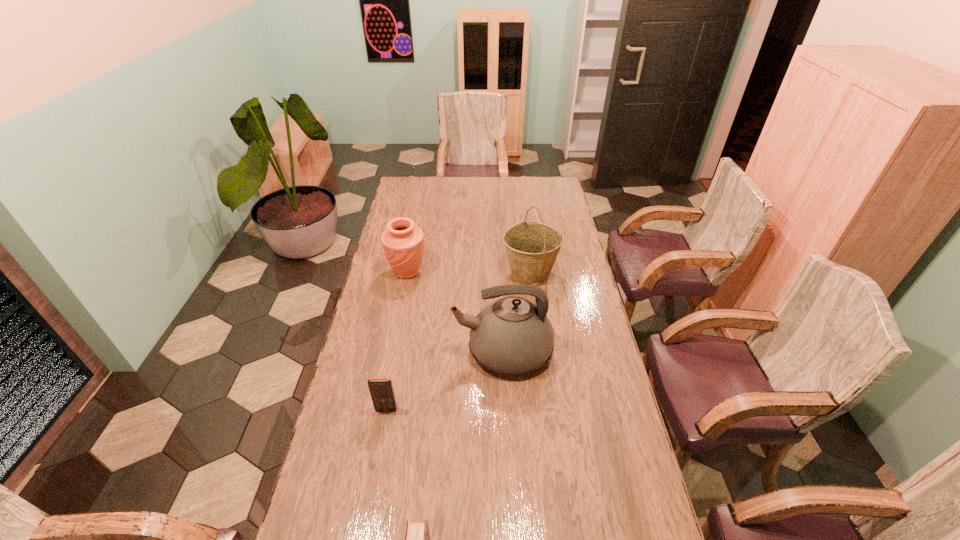
Locate an element on the screen. The image size is (960, 540). vacant point located between the second nearest object and the wine bucket is located at coordinates (458, 342).

Where is `object that is the fourth closest one to the third nearest object`? object that is the fourth closest one to the third nearest object is located at coordinates (417, 539).

Identify which object is the second nearest to the kettle. Please provide its 2D coordinates. Your answer should be formatted as a tuple, i.e. [(x, y)], where the tuple contains the x and y coordinates of a point satisfying the conditions above.

[(381, 390)]

Locate an element on the screen. Image resolution: width=960 pixels, height=540 pixels. blank space that satisfies the following two spatial constraints: 1. at the spout of the kettle; 2. on the screen of the fourth farthest object is located at coordinates (506, 409).

I want to click on vacant space that satisfies the following two spatial constraints: 1. at the spout of the kettle; 2. on the screen of the fourth farthest object, so click(506, 409).